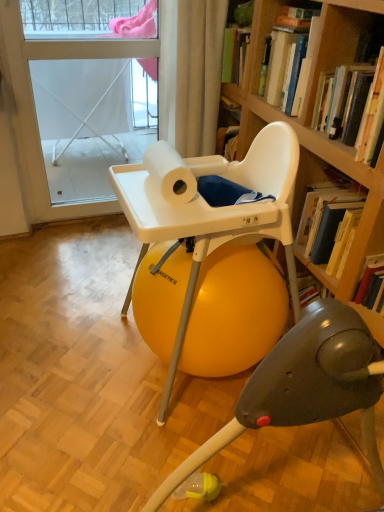
Question: Is point (340, 84) closer or farther from the camera than point (18, 76)?

Choices:
 (A) farther
 (B) closer

Answer: (B)

Question: Would you say hardcover book at upper right, which is the 2th book in back-to-front order, is to the left or to the right of white fabric screen door at upper left in the picture?

Choices:
 (A) left
 (B) right

Answer: (B)

Question: Which of these objects is positioned closest to the hardcover book at upper right, which is the 1th book from back to front?

Choices:
 (A) white fabric curtain at upper center
 (B) white fabric screen door at upper left
 (C) white plastic highchair at center
 (D) hardcover book at upper right, the 1th book from the front
 (E) white matte paper towel at center

Answer: (D)

Question: Considering the real-world distances, which object is closest to the hardcover book at upper right, the 2th book from the front?

Choices:
 (A) hardcover book at upper right, the 1th book from the front
 (B) white matte paper towel at center
 (C) white fabric curtain at upper center
 (D) white plastic highchair at center
 (E) white fabric screen door at upper left

Answer: (A)